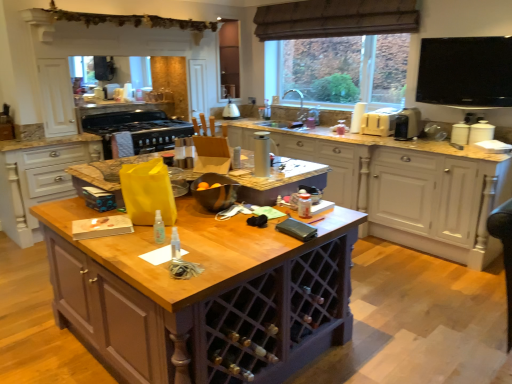
The image size is (512, 384). Identify the location of free space above metallic silver bowl at center, which is the 5th appliance in right-to-left order (from a real-world perspective). (214, 174).